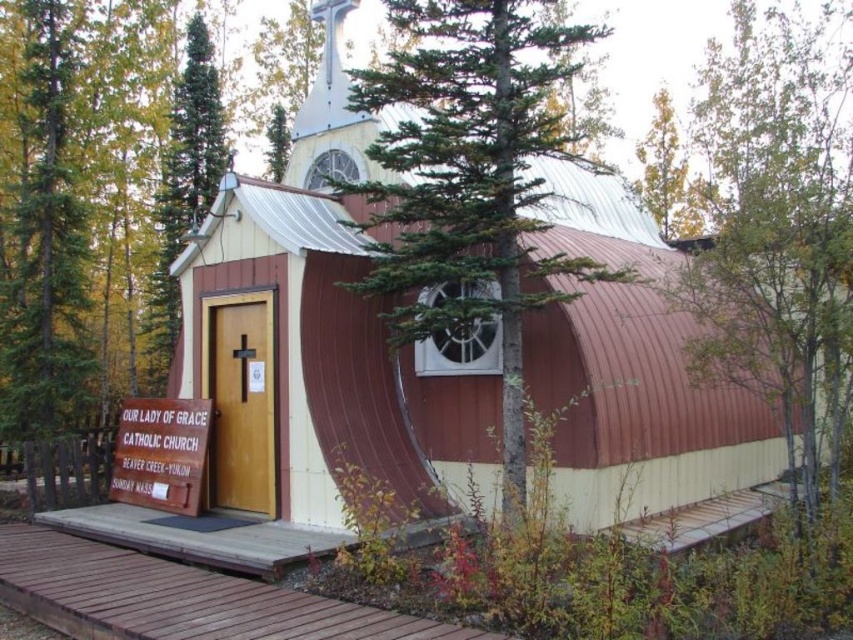
You are standing in front of the church and notice two points marked on the structure. The first point is at coordinate point (381, 68) and the second is at point (141, 419). Which point is closer to you?

Point (141, 419) is closer to you because it is less further to the camera than point (381, 68).

You are a delivery person trying to park your 2.5 meter wide truck. You see the brown wooden walkway at lower center and the green coniferous tree at upper left. Can the walkway accommodate your truck?

The brown wooden walkway at lower center might be wider than green coniferous tree at upper left, so it is possible that the walkway can accommodate your 2.5 meter wide truck.